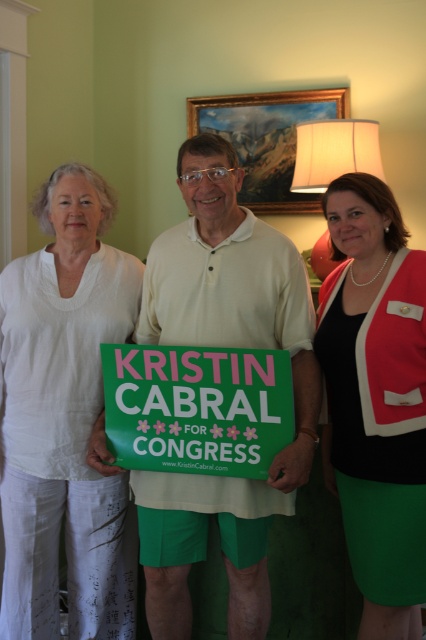
You are a photographer adjusting the camera settings. You notice the white cotton polo shirt at center and the white linen pants at left are both in focus. Which clothing item is closer to the camera?

The white linen pants at left are closer to the camera because the white cotton polo shirt at center is behind them.

You are a photographer setting up for a group photo. You need to ensure that the white linen pants at left and the green matte sign at center are both visible in the frame. Based on their heights, which object should you focus on first to ensure both are in focus?

The white linen pants at left is taller than the green matte sign at center, so you should focus on the white linen pants at left first to ensure both are in focus.